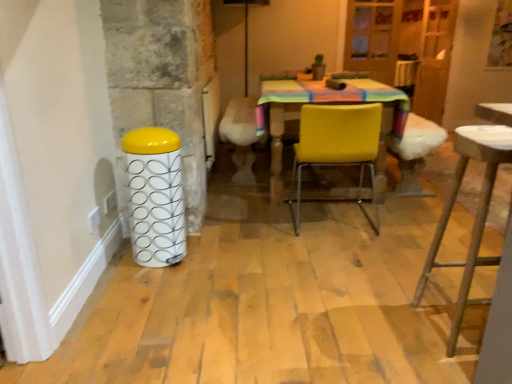
Question: Is point (466, 276) closer or farther from the camera than point (367, 112)?

Choices:
 (A) closer
 (B) farther

Answer: (A)

Question: From the image's perspective, is metallic stool at right positioned above or below yellow matte chair at center?

Choices:
 (A) above
 (B) below

Answer: (B)

Question: Based on their relative distances, which object is nearer to the white glossy bar stool at left?

Choices:
 (A) metallic stool at right
 (B) yellow matte chair at center

Answer: (B)

Question: Estimate the real-world distances between objects in this image. Which object is closer to the metallic stool at right?

Choices:
 (A) white glossy bar stool at left
 (B) yellow matte chair at center

Answer: (B)